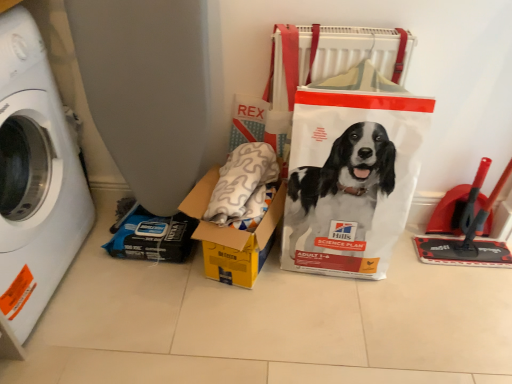
You are a GUI agent. You are given a task and a screenshot of the screen. Output one action in this format:
    pyautogui.click(x=<x>, y=<y>)
    Task: Click on the vacant space in front of yellow cardboard box at center
    
    Given the screenshot: What is the action you would take?
    pyautogui.click(x=223, y=334)